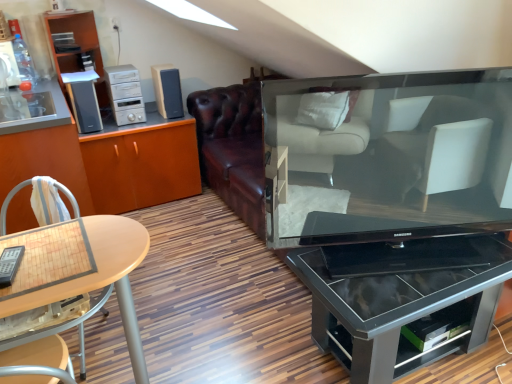
Question: Considering their positions, is silver metallic stereo at upper left, the 1th appliance in the right-to-left sequence, located in front of or behind white woven fabric at left?

Choices:
 (A) behind
 (B) front

Answer: (A)

Question: Does point (130, 82) appear closer or farther from the camera than point (57, 188)?

Choices:
 (A) farther
 (B) closer

Answer: (A)

Question: Estimate the real-world distances between objects in this image. Which object is farther from the wooden cabinet at left, arranged as the second cabinetry when viewed from the right?

Choices:
 (A) matte wood shelf at upper left
 (B) white woven fabric at left
 (C) silver metallic stereo at upper left, the 1th appliance in the right-to-left sequence
 (D) wooden light brown chair at lower left
 (E) satin black speaker at upper left, acting as the 1th appliance starting from the left

Answer: (A)

Question: Estimate the real-world distances between objects in this image. Which object is closer to the wooden cabinet at left, arranged as the second cabinetry when viewed from the right?

Choices:
 (A) slate gray plastic speaker at upper left
 (B) satin black speaker at upper left, arranged as the second appliance when viewed from the right
 (C) white woven fabric at left
 (D) matte wood shelf at upper left
 (E) black glossy television at center

Answer: (C)